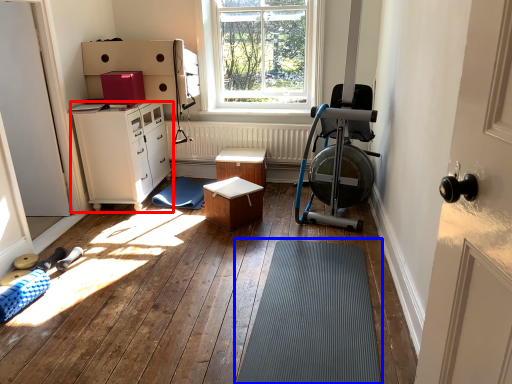
Question: Which of the following is the farthest to the observer, chest of drawers (highlighted by a red box) or bath mat (highlighted by a blue box)?

Choices:
 (A) chest of drawers
 (B) bath mat

Answer: (A)